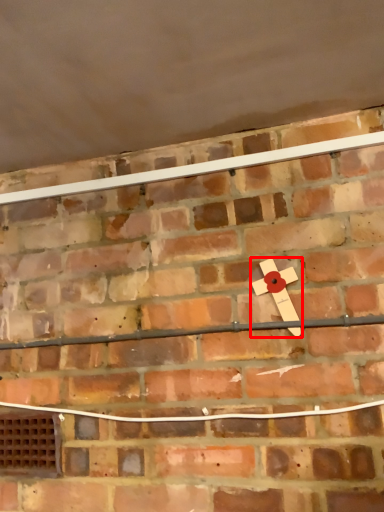
Question: From the image's perspective, what is the correct spatial positioning of magnet (annotated by the red box) in reference to window?

Choices:
 (A) above
 (B) below

Answer: (A)